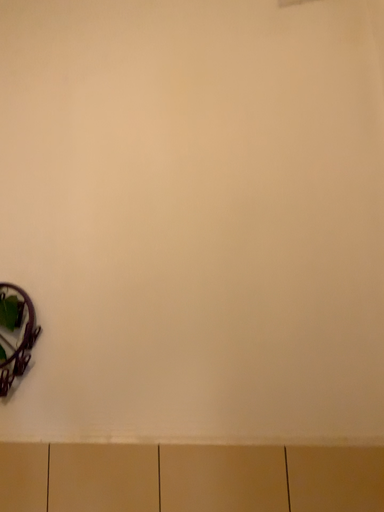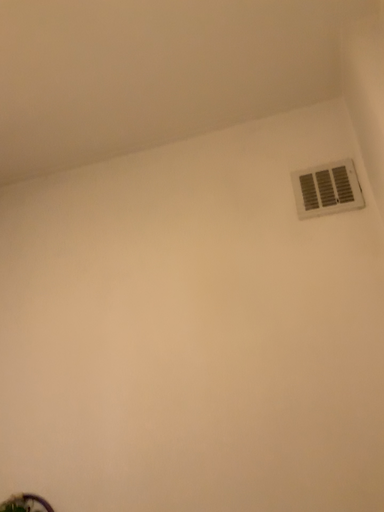
Question: Which way did the camera rotate in the video?

Choices:
 (A) rotated downward
 (B) rotated upward

Answer: (B)